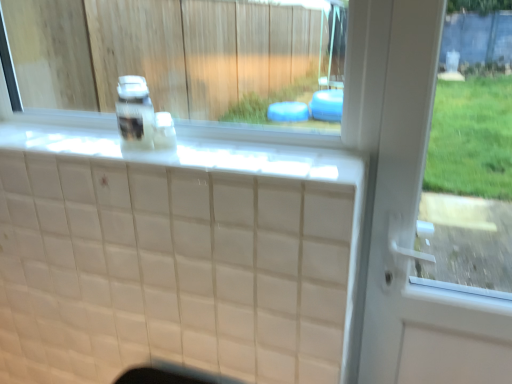
Question: Is clear plastic bottle at center, marked as the second bottle in a right-to-left arrangement, turned away from translucent plastic bottle at center, marked as the second bottle in a left-to-right arrangement?

Choices:
 (A) no
 (B) yes

Answer: (A)

Question: From the image's perspective, is clear plastic bottle at center, marked as the second bottle in a right-to-left arrangement, located above translucent plastic bottle at center, marked as the second bottle in a left-to-right arrangement?

Choices:
 (A) no
 (B) yes

Answer: (B)

Question: Does clear plastic bottle at center, marked as the second bottle in a right-to-left arrangement, have a lesser width compared to translucent plastic bottle at center, acting as the first bottle starting from the right?

Choices:
 (A) no
 (B) yes

Answer: (A)

Question: From a real-world perspective, is clear plastic bottle at center, marked as the second bottle in a right-to-left arrangement, positioned under translucent plastic bottle at center, marked as the second bottle in a left-to-right arrangement, based on gravity?

Choices:
 (A) no
 (B) yes

Answer: (A)

Question: Would you say clear plastic bottle at center, marked as the second bottle in a right-to-left arrangement, is a long distance from translucent plastic bottle at center, marked as the second bottle in a left-to-right arrangement?

Choices:
 (A) yes
 (B) no

Answer: (B)

Question: Can you confirm if clear plastic bottle at center, which is counted as the 1th bottle, starting from the left, is smaller than translucent plastic bottle at center, marked as the second bottle in a left-to-right arrangement?

Choices:
 (A) yes
 (B) no

Answer: (B)

Question: Can you see translucent plastic bottle at center, marked as the second bottle in a left-to-right arrangement, touching white glossy window sill at upper center?

Choices:
 (A) yes
 (B) no

Answer: (B)

Question: Could you tell me if translucent plastic bottle at center, acting as the first bottle starting from the right, is facing white glossy window sill at upper center?

Choices:
 (A) no
 (B) yes

Answer: (A)

Question: Is translucent plastic bottle at center, acting as the first bottle starting from the right, further to camera compared to white glossy window sill at upper center?

Choices:
 (A) yes
 (B) no

Answer: (A)

Question: Is white glossy window sill at upper center surrounded by translucent plastic bottle at center, marked as the second bottle in a left-to-right arrangement?

Choices:
 (A) yes
 (B) no

Answer: (B)

Question: Considering the relative sizes of translucent plastic bottle at center, marked as the second bottle in a left-to-right arrangement, and white glossy window sill at upper center in the image provided, is translucent plastic bottle at center, marked as the second bottle in a left-to-right arrangement, shorter than white glossy window sill at upper center?

Choices:
 (A) yes
 (B) no

Answer: (A)

Question: Considering the relative sizes of translucent plastic bottle at center, marked as the second bottle in a left-to-right arrangement, and white glossy window sill at upper center in the image provided, is translucent plastic bottle at center, marked as the second bottle in a left-to-right arrangement, thinner than white glossy window sill at upper center?

Choices:
 (A) yes
 (B) no

Answer: (A)

Question: From a real-world perspective, is white glossy window sill at upper center on top of clear plastic bottle at center, marked as the second bottle in a right-to-left arrangement?

Choices:
 (A) yes
 (B) no

Answer: (A)